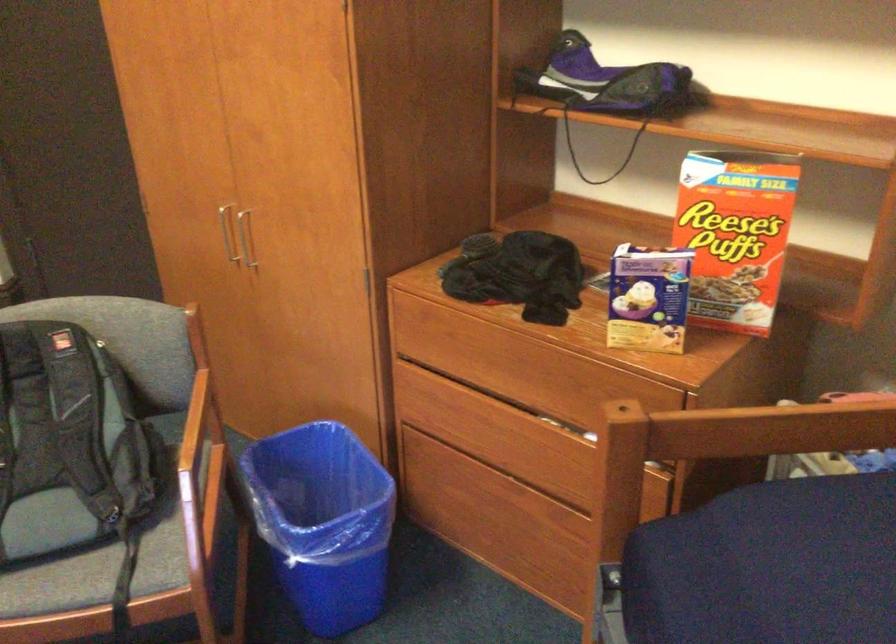
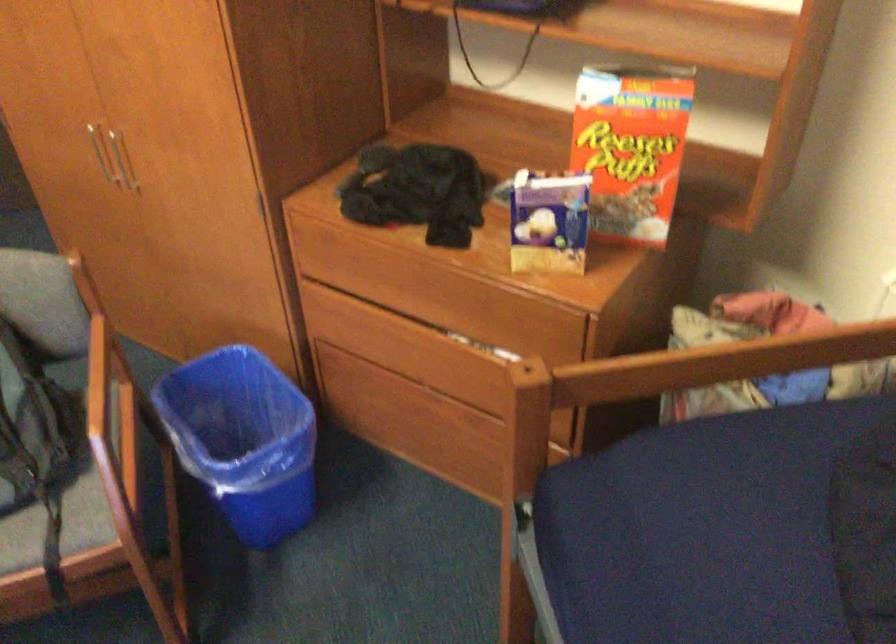
Locate, in the second image, the point that corresponds to (486,346) in the first image.

(392, 269)